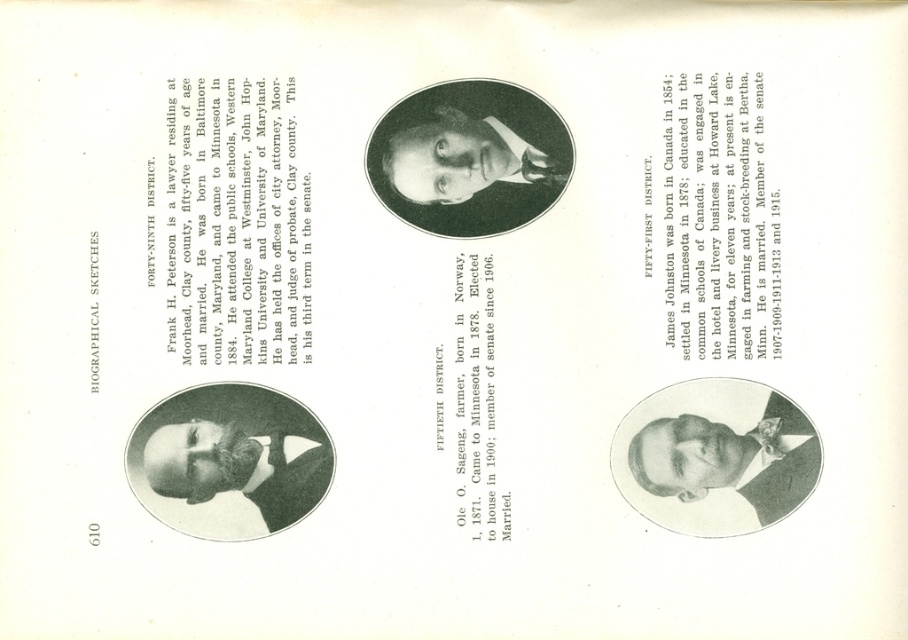
Question: Does black paper at upper center have a larger size compared to black paper text at center?

Choices:
 (A) no
 (B) yes

Answer: (B)

Question: Considering the real-world distances, which object is farthest from the black paper at upper right?

Choices:
 (A) smooth black suit at lower right
 (B) black paper at upper center
 (C) black matte portrait at center

Answer: (B)

Question: Which of the following is the closest to the observer?

Choices:
 (A) black paper text at center
 (B) black paper at upper right
 (C) smooth black suit at lower right
 (D) black matte portrait at center

Answer: (C)

Question: Can you confirm if black paper at upper right is positioned above smooth black beard at center?

Choices:
 (A) yes
 (B) no

Answer: (A)

Question: Is black paper at upper right above smooth black beard at center?

Choices:
 (A) yes
 (B) no

Answer: (A)

Question: Which object appears farthest from the camera in this image?

Choices:
 (A) black paper at upper center
 (B) smooth black suit at lower right
 (C) black paper text at center

Answer: (C)